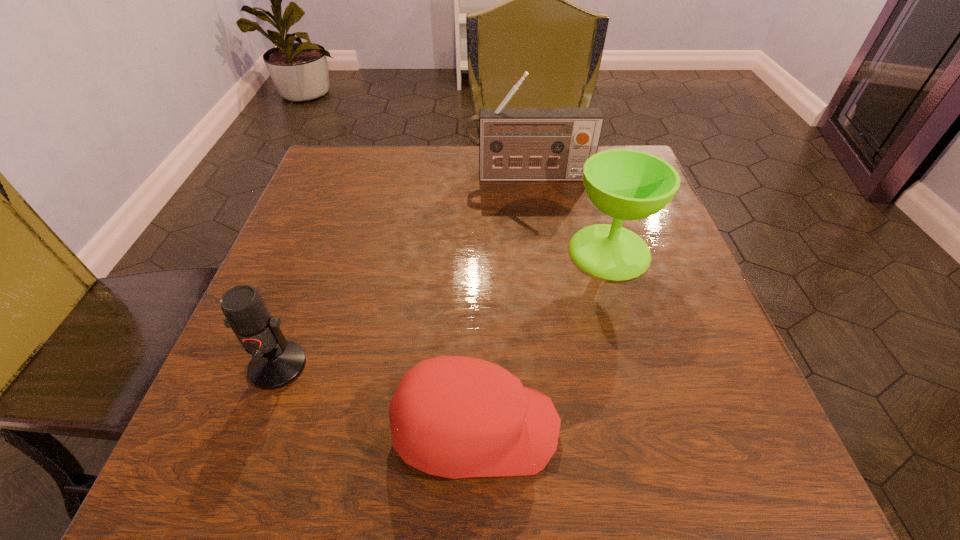
The image size is (960, 540). What are the coordinates of `the second closest object to the leftmost object` in the screenshot? It's located at (626, 184).

At what (x,y) coordinates should I click in order to perform the action: click on vacant space that satisfies the following two spatial constraints: 1. on the front panel of the farthest object; 2. on the left side of the wineglass. Please return your answer as a coordinate pair (x, y). The image size is (960, 540). Looking at the image, I should click on (539, 252).

The image size is (960, 540). In order to click on free point that satisfies the following two spatial constraints: 1. on the front panel of the tallest object; 2. on the right side of the second farthest object in this screenshot , I will do `click(539, 252)`.

Where is `free space in the image that satisfies the following two spatial constraints: 1. on the front panel of the tallest object; 2. on the front-facing side of the cap`? Image resolution: width=960 pixels, height=540 pixels. free space in the image that satisfies the following two spatial constraints: 1. on the front panel of the tallest object; 2. on the front-facing side of the cap is located at coordinates (563, 429).

Locate an element on the screen. Image resolution: width=960 pixels, height=540 pixels. free spot that satisfies the following two spatial constraints: 1. on the front panel of the farthest object; 2. on the front-facing side of the shortest object is located at coordinates (563, 429).

Locate an element on the screen. The height and width of the screenshot is (540, 960). free location that satisfies the following two spatial constraints: 1. on the front panel of the radio receiver; 2. on the front-facing side of the shortest object is located at coordinates pos(563,429).